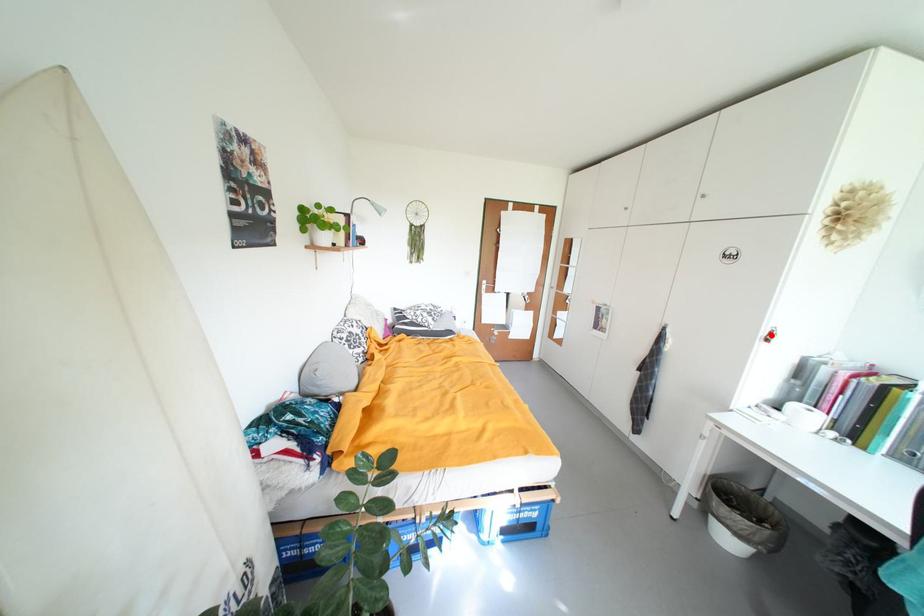
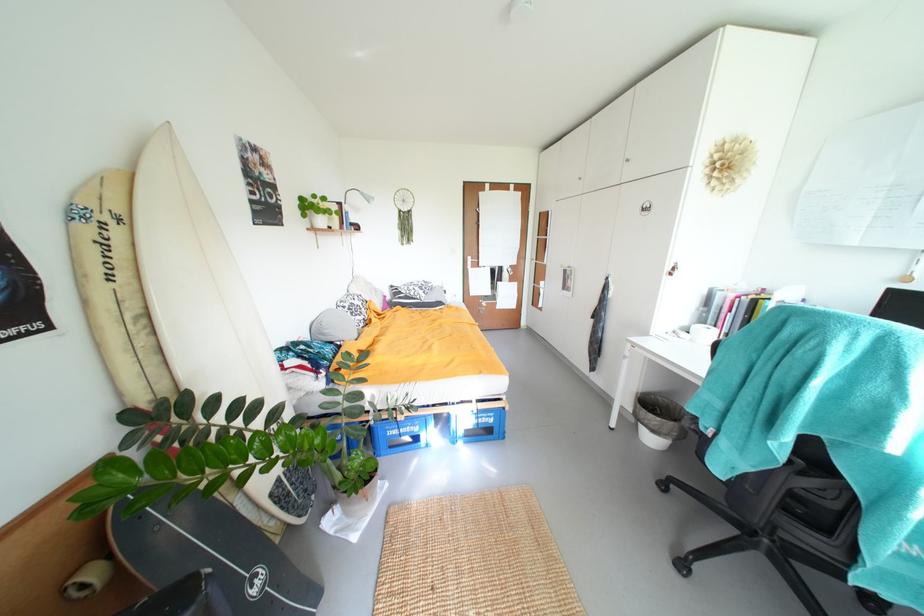
Where in the second image is the point corresponding to the highlighted location from the first image?

(675, 270)